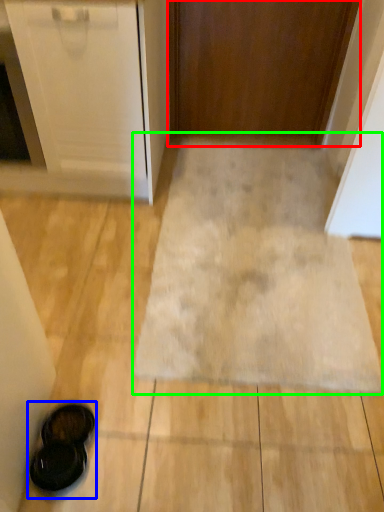
Question: Which object is the farthest from door (highlighted by a red box)? Choose among these: footwear (highlighted by a blue box) or bath mat (highlighted by a green box).

Choices:
 (A) footwear
 (B) bath mat

Answer: (A)